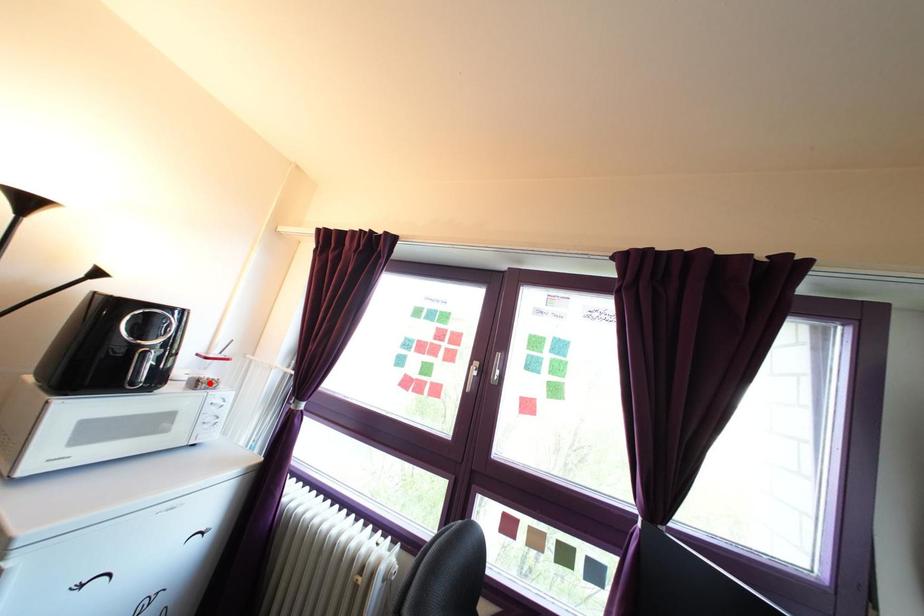
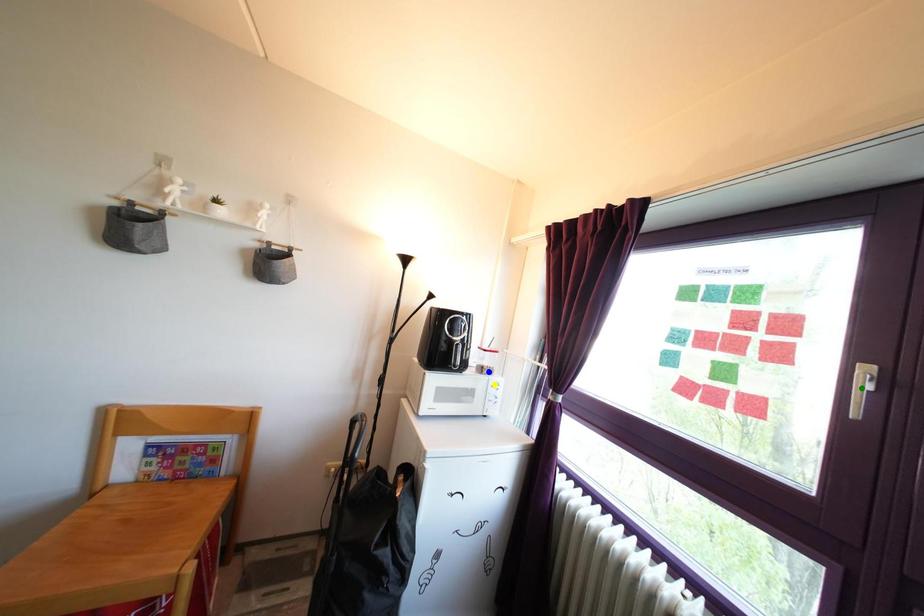
Question: I am providing you with two images of the same scene from different viewpoints. A red point is marked on the first image. You are given multiple points on the second image. Can you choose the point in image 2 that corresponds to the point in image 1?

Choices:
 (A) yellow point
 (B) blue point
 (C) green point

Answer: (B)